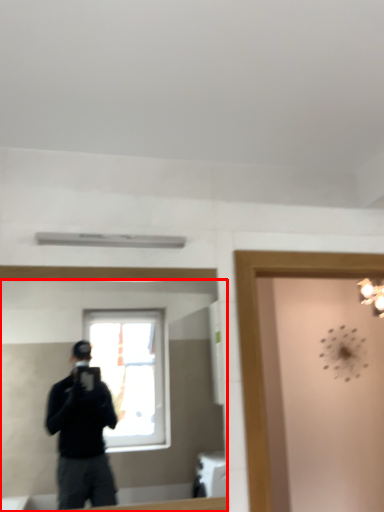
Question: From the image's perspective, what is the correct spatial positioning of mirror (annotated by the red box) in reference to glass door?

Choices:
 (A) below
 (B) above

Answer: (B)